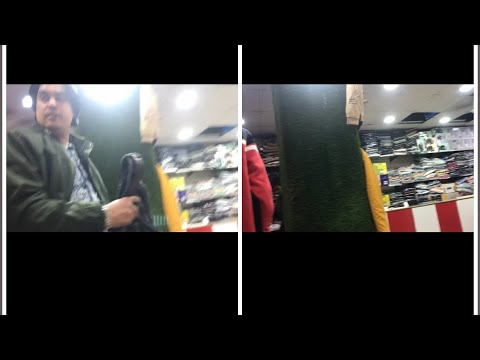
I want to click on ceiling, so click(x=261, y=113), click(x=217, y=101), click(x=425, y=100), click(x=13, y=94).